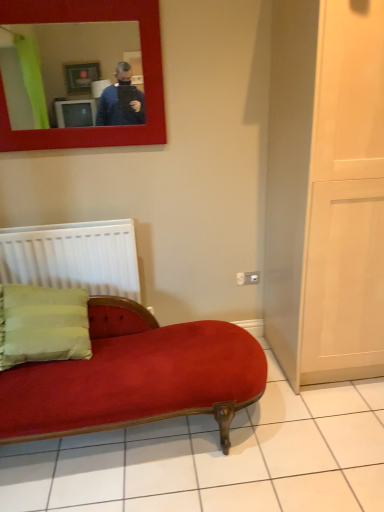
Question: From the image's perspective, is white matte radiator at left on top of matte red mirror at upper left?

Choices:
 (A) yes
 (B) no

Answer: (B)

Question: Is white matte radiator at left aimed at matte red mirror at upper left?

Choices:
 (A) yes
 (B) no

Answer: (B)

Question: Does white matte radiator at left come in front of matte red mirror at upper left?

Choices:
 (A) yes
 (B) no

Answer: (B)

Question: Is white matte radiator at left at the right side of matte red mirror at upper left?

Choices:
 (A) no
 (B) yes

Answer: (A)

Question: Is white matte radiator at left positioned with its back to matte red mirror at upper left?

Choices:
 (A) no
 (B) yes

Answer: (A)

Question: Is white matte radiator at left not inside matte red mirror at upper left?

Choices:
 (A) yes
 (B) no

Answer: (A)

Question: Does matte red mirror at upper left appear on the right side of white matte radiator at left?

Choices:
 (A) no
 (B) yes

Answer: (B)

Question: Considering the relative sizes of matte red mirror at upper left and white matte radiator at left in the image provided, is matte red mirror at upper left wider than white matte radiator at left?

Choices:
 (A) yes
 (B) no

Answer: (B)

Question: From a real-world perspective, is matte red mirror at upper left below white matte radiator at left?

Choices:
 (A) no
 (B) yes

Answer: (A)

Question: Can you confirm if matte red mirror at upper left is thinner than white matte radiator at left?

Choices:
 (A) no
 (B) yes

Answer: (B)

Question: From a real-world perspective, is matte red mirror at upper left physically above white matte radiator at left?

Choices:
 (A) no
 (B) yes

Answer: (B)

Question: Considering the relative sizes of matte red mirror at upper left and white matte radiator at left in the image provided, is matte red mirror at upper left taller than white matte radiator at left?

Choices:
 (A) no
 (B) yes

Answer: (B)

Question: Relative to matte red mirror at upper left, is white matte radiator at left in front or behind?

Choices:
 (A) front
 (B) behind

Answer: (B)